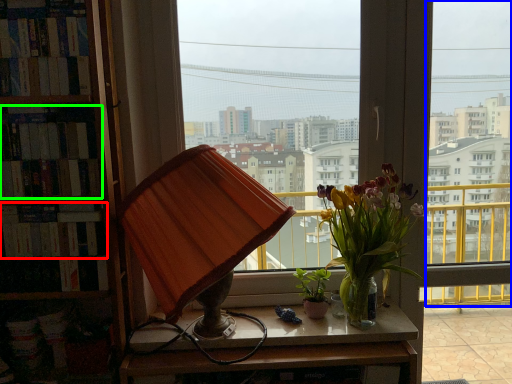
Question: Based on their relative distances, which object is nearer to book (highlighted by a red box)? Choose from window (highlighted by a blue box) and book (highlighted by a green box).

Choices:
 (A) window
 (B) book

Answer: (B)